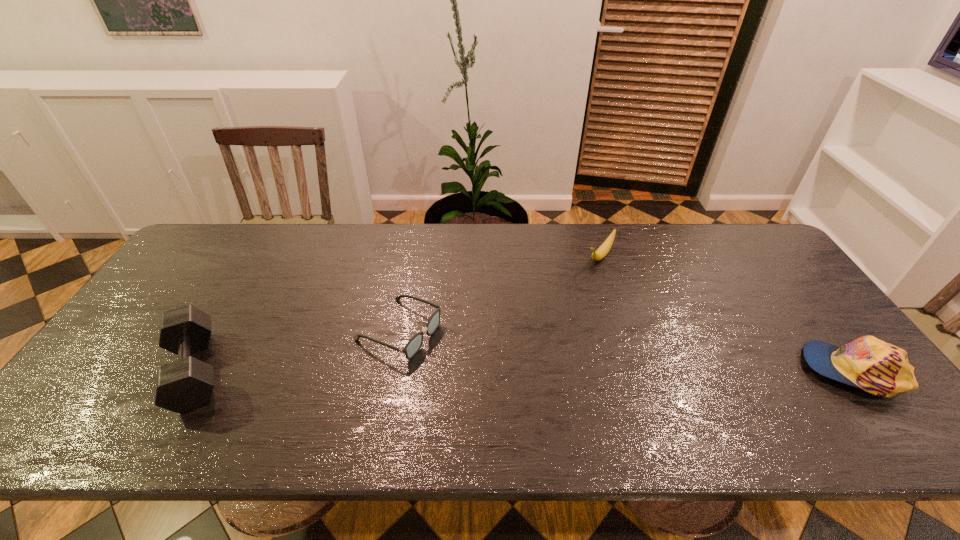
I want to click on free space on the desktop that is between the leftmost object and the rightmost object and is positioned on the face of the shortest object, so click(x=482, y=370).

The height and width of the screenshot is (540, 960). I want to click on free space on the desktop that is between the leftmost object and the cap and is positioned at the stem of the farthest object, so click(x=503, y=370).